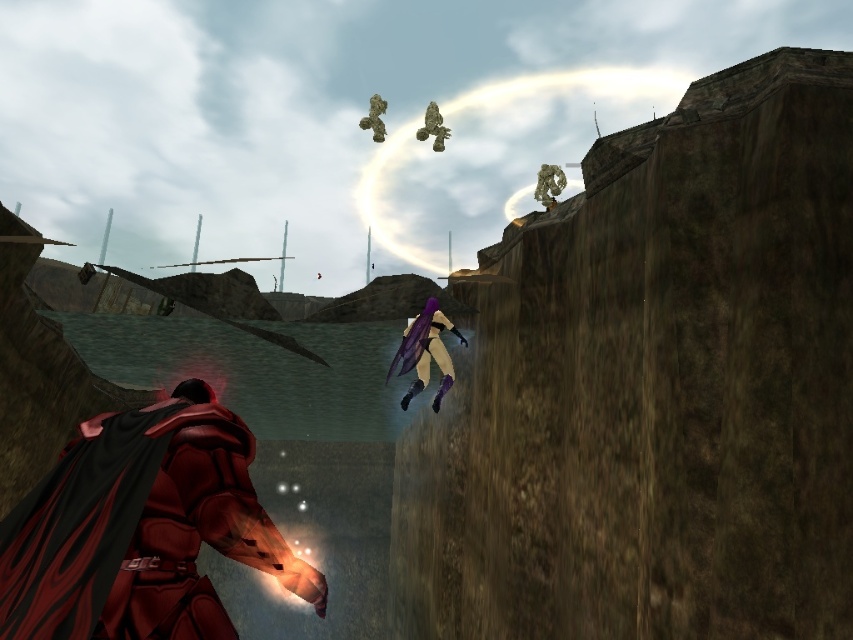
You are a game developer designing a level where the shiny red armor at center and the purple matte wings at center are placed in a confined space. The minimum required distance between them is 3 meters to allow for animation and movement. Can they be placed in this space without violating the distance requirement?

The shiny red armor at center and the purple matte wings at center are 3.17 meters apart, which exceeds the 3 meter minimum requirement. They can be placed in the confined space without violating the distance requirement.

You are a character in the game and need to move from point A to point B. The points are labeled as point (53, 492) and point (424, 326). Which point should you start from if you want to begin your journey closer to the camera?

You should start from point (53, 492) because it is closer to the camera than point (424, 326).

Based on the photo, you are a game developer working on a new level for this game. You need to place a glowing red energy effect at the exact location of the shiny red armor at center. What are the coordinates where you should place this effect?

The coordinates for the shiny red armor at center are at point (141, 529), so you should place the glowing red energy effect at those coordinates.